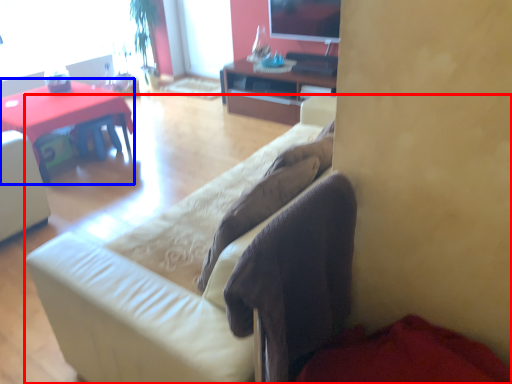
Question: Which object is closer to the camera taking this photo, studio couch (highlighted by a red box) or desk (highlighted by a blue box)?

Choices:
 (A) studio couch
 (B) desk

Answer: (A)